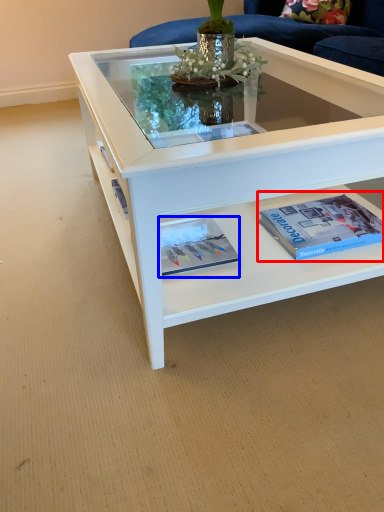
Question: Among these objects, which one is nearest to the camera, paperback book (highlighted by a red box) or magazine (highlighted by a blue box)?

Choices:
 (A) paperback book
 (B) magazine

Answer: (B)